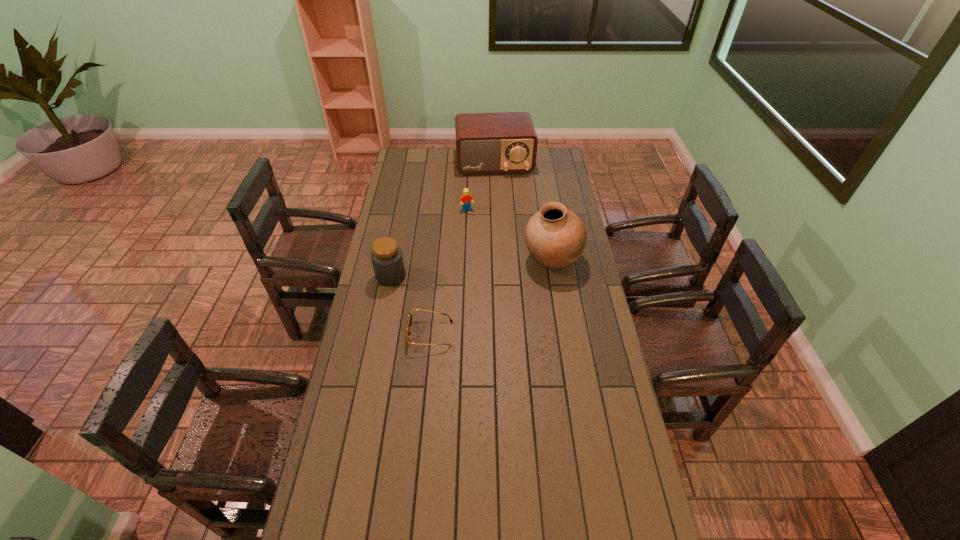
Locate an element on the screen. free space that satisfies the following two spatial constraints: 1. on the back side of the leftmost object; 2. on the left side of the farthest object is located at coordinates (413, 163).